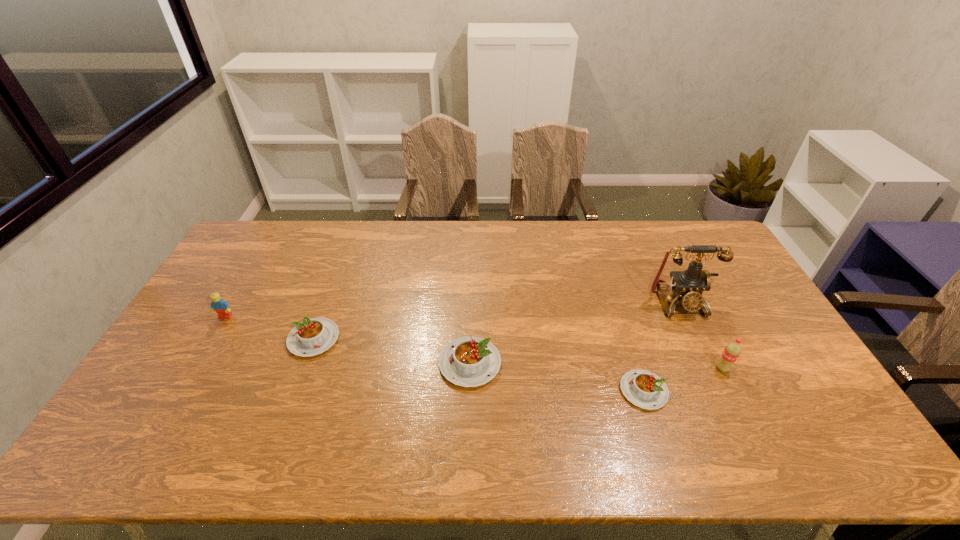
Where is `the second shortest pudding`? This screenshot has height=540, width=960. the second shortest pudding is located at coordinates (311, 337).

At what (x,y) coordinates should I click in order to perform the action: click on the fifth object from right to left. Please return your answer as a coordinate pair (x, y). This screenshot has height=540, width=960. Looking at the image, I should click on (311, 337).

Where is `the third object from left to right`? Image resolution: width=960 pixels, height=540 pixels. the third object from left to right is located at coordinates (470, 361).

You are a GUI agent. You are given a task and a screenshot of the screen. Output one action in this format:
    pyautogui.click(x=<x>, y=<y>)
    Task: Click on the shortest object
    
    Given the screenshot: What is the action you would take?
    pyautogui.click(x=644, y=389)

Locate an element on the screen. the fourth object from left to right is located at coordinates (644, 389).

This screenshot has height=540, width=960. Identify the location of telephone. (687, 286).

Locate an element on the screen. This screenshot has width=960, height=540. the leftmost object is located at coordinates (218, 304).

Locate an element on the screen. This screenshot has width=960, height=540. Lego is located at coordinates (218, 304).

Find the location of `soda`. soda is located at coordinates (732, 351).

You are a GUI agent. You are given a task and a screenshot of the screen. Output one action in this format:
    pyautogui.click(x=<x>, y=<y>)
    Task: Click on the vacant space located on the right of the leftmost pudding
    The width and height of the screenshot is (960, 540).
    Given the screenshot: What is the action you would take?
    coord(363,339)